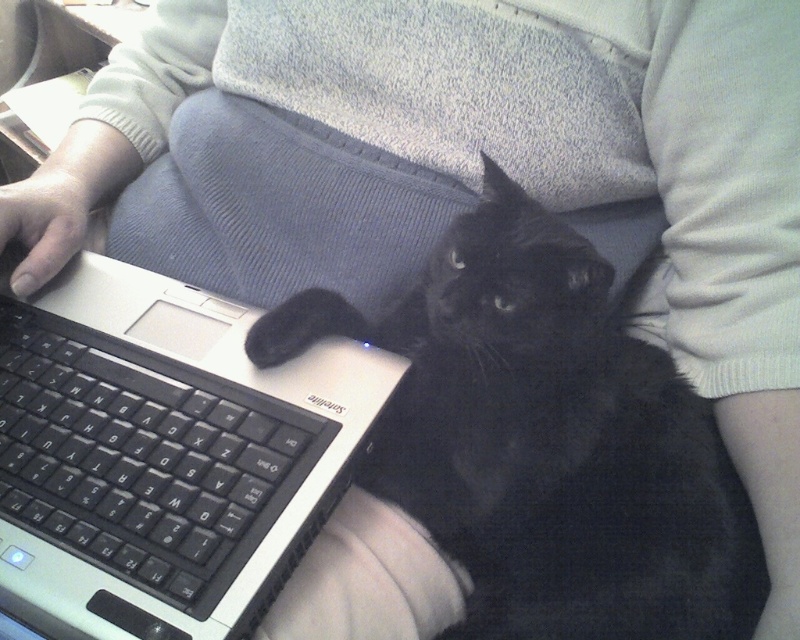
Question: Is black fur cat at center positioned behind black matte laptop at left?

Choices:
 (A) yes
 (B) no

Answer: (A)

Question: Which point is closer to the camera?

Choices:
 (A) (560, 438)
 (B) (61, 502)

Answer: (B)

Question: Where is black fur cat at center located in relation to black matte laptop at left in the image?

Choices:
 (A) above
 (B) below

Answer: (B)

Question: Does black fur cat at center appear under black matte laptop at left?

Choices:
 (A) yes
 (B) no

Answer: (A)

Question: Which of the following is the farthest from the observer?

Choices:
 (A) black matte laptop at left
 (B) black fur cat at center

Answer: (B)